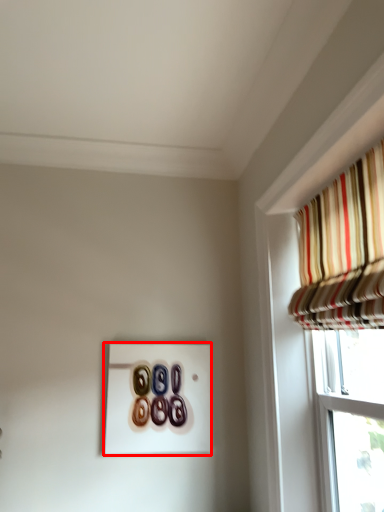
Question: From the image's perspective, what is the correct spatial relationship of button (annotated by the red box) in relation to curtain?

Choices:
 (A) above
 (B) below

Answer: (B)